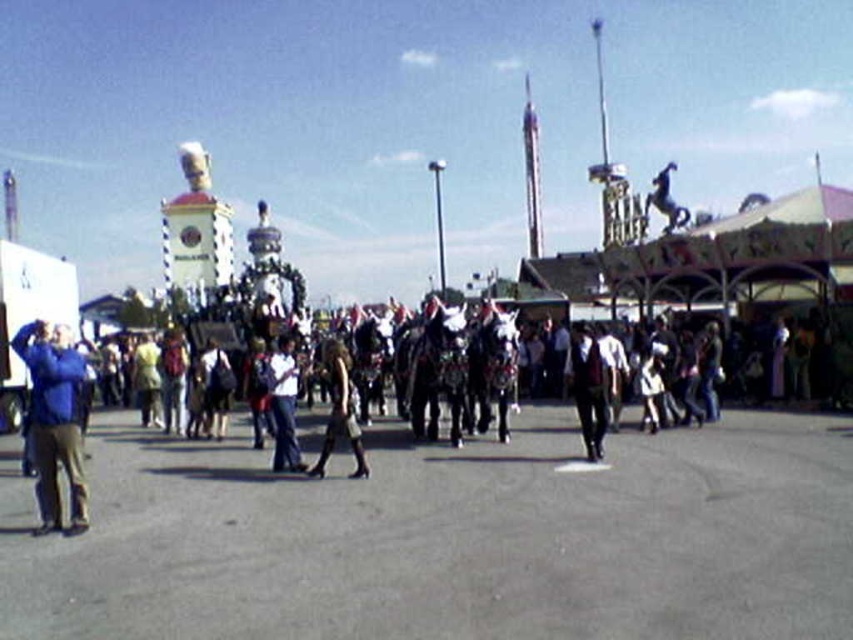
Describe the element at coordinates (54, 419) in the screenshot. I see `blue fabric jacket at left` at that location.

Locate an element on the screen. blue fabric jacket at left is located at coordinates (54, 419).

Which is more to the left, black leather boots at center or white cotton shirt at center?

white cotton shirt at center is more to the left.

In the scene shown: Measure the distance between black leather boots at center and white cotton shirt at center.

black leather boots at center is 17.02 feet from white cotton shirt at center.

Locate an element on the screen. The height and width of the screenshot is (640, 853). black leather boots at center is located at coordinates (340, 410).

Can you confirm if blue fabric jacket at left is positioned to the right of white cotton shirt at center?

No, blue fabric jacket at left is not to the right of white cotton shirt at center.

Between blue fabric jacket at left and white cotton shirt at center, which one appears on the right side from the viewer's perspective?

From the viewer's perspective, white cotton shirt at center appears more on the right side.

Where is `blue fabric jacket at left`? The height and width of the screenshot is (640, 853). blue fabric jacket at left is located at coordinates (54, 419).